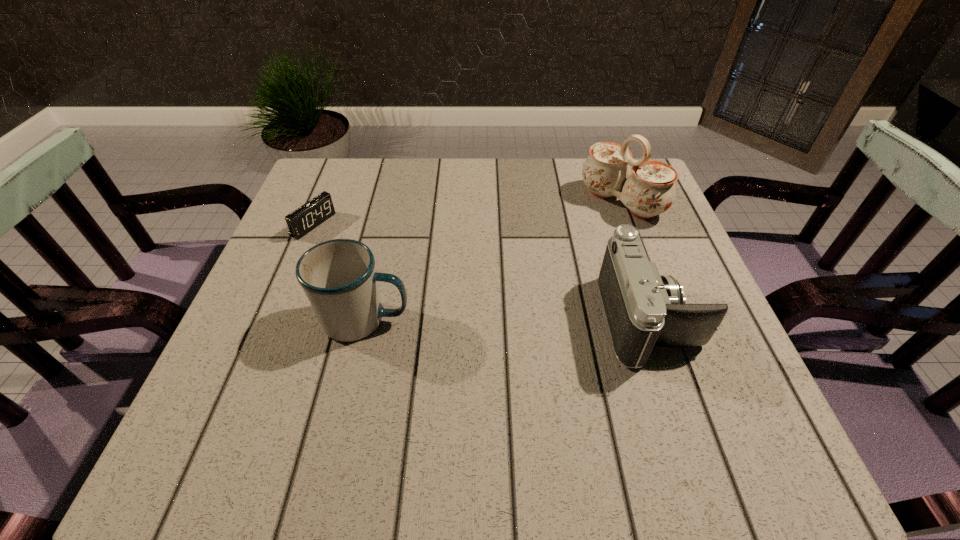
Locate an element on the screen. vacant space located 0.070m by the handle of the chinaware is located at coordinates (581, 233).

The image size is (960, 540). I want to click on vacant space located 0.260m by the handle of the chinaware, so click(x=528, y=273).

Where is `alarm clock positioned at the far edge`? alarm clock positioned at the far edge is located at coordinates (307, 217).

The width and height of the screenshot is (960, 540). I want to click on chinaware that is at the far edge, so click(650, 190).

This screenshot has height=540, width=960. What are the coordinates of `object at the near edge` in the screenshot? It's located at (643, 309).

Identify the location of mug present at the left edge. (338, 276).

The width and height of the screenshot is (960, 540). Identify the location of alarm clock that is at the left edge. (307, 217).

Locate an element on the screen. The image size is (960, 540). camera at the right edge is located at coordinates (643, 309).

At what (x,y) coordinates should I click in order to perform the action: click on chinaware that is at the right edge. Please return your answer as a coordinate pair (x, y). Looking at the image, I should click on (650, 190).

Find the location of `object present at the far left corner`. object present at the far left corner is located at coordinates (307, 217).